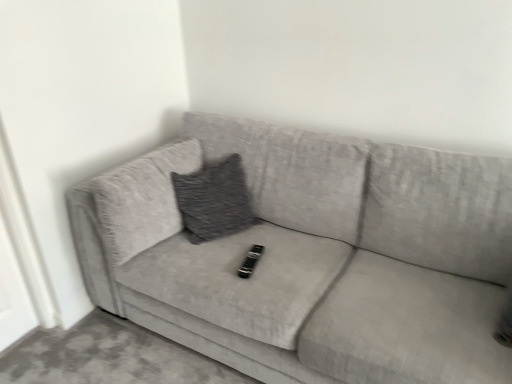
Describe the element at coordinates (250, 261) in the screenshot. I see `black plastic remote at center` at that location.

In order to face black plastic remote at center, should I rotate leftwards or rightwards?

Turn left approximately 0.611 degrees to face it.

At what (x,y) coordinates should I click in order to perform the action: click on black plastic remote at center. Please return your answer as a coordinate pair (x, y). The height and width of the screenshot is (384, 512). Looking at the image, I should click on (250, 261).

What is the approximate width of textured gray couch at center?

textured gray couch at center is 1.01 meters wide.

The image size is (512, 384). What do you see at coordinates (312, 256) in the screenshot?
I see `textured gray couch at center` at bounding box center [312, 256].

Where is `textured gray couch at center`? This screenshot has height=384, width=512. textured gray couch at center is located at coordinates (312, 256).

Where is `black plastic remote at center`? The height and width of the screenshot is (384, 512). black plastic remote at center is located at coordinates (250, 261).

Is black plastic remote at center at the right side of textured gray couch at center?

No, black plastic remote at center is not to the right of textured gray couch at center.

Considering the relative positions of black plastic remote at center and textured gray couch at center in the image provided, is black plastic remote at center in front of textured gray couch at center?

No, it is behind textured gray couch at center.

Considering the points (246, 271) and (280, 327), which point is in front, point (246, 271) or point (280, 327)?

Point (280, 327)

From the image's perspective, which one is positioned higher, black plastic remote at center or textured gray couch at center?

textured gray couch at center appears higher in the image.

From a real-world perspective, which is physically below, black plastic remote at center or textured gray couch at center?

In real-world perspective, textured gray couch at center is lower.

Does black plastic remote at center have a lesser width compared to textured gray couch at center?

Correct, the width of black plastic remote at center is less than that of textured gray couch at center.

Is black plastic remote at center taller than textured gray couch at center?

In fact, black plastic remote at center may be shorter than textured gray couch at center.

Considering the sizes of black plastic remote at center and textured gray couch at center in the image, is black plastic remote at center bigger or smaller than textured gray couch at center?

black plastic remote at center is smaller than textured gray couch at center.

Is textured gray couch at center surrounded by black plastic remote at center?

No, textured gray couch at center is not inside black plastic remote at center.

Is black plastic remote at center in contact with textured gray couch at center?

black plastic remote at center is not next to textured gray couch at center, and they're not touching.

Is black plastic remote at center oriented towards textured gray couch at center?

Yes, black plastic remote at center is oriented towards textured gray couch at center.

Find the location of a particular element. The width and height of the screenshot is (512, 384). studio couch on the right of black plastic remote at center is located at coordinates (312, 256).

Does textured gray couch at center appear on the left side of black plastic remote at center?

In fact, textured gray couch at center is to the right of black plastic remote at center.

Does textured gray couch at center come behind black plastic remote at center?

No, the depth of textured gray couch at center is less than that of black plastic remote at center.

Does point (443, 240) appear closer or farther from the camera than point (240, 274)?

Point (443, 240) is farther from the camera than point (240, 274).

From the image's perspective, is textured gray couch at center below black plastic remote at center?

No, from the image's perspective, textured gray couch at center is not below black plastic remote at center.

From a real-world perspective, is textured gray couch at center physically located above or below black plastic remote at center?

textured gray couch at center is below black plastic remote at center.

Which object is thinner, textured gray couch at center or black plastic remote at center?

With smaller width is black plastic remote at center.

Which of these two, textured gray couch at center or black plastic remote at center, stands taller?

textured gray couch at center is taller.

Does textured gray couch at center have a smaller size compared to black plastic remote at center?

Actually, textured gray couch at center might be larger than black plastic remote at center.

Would you say textured gray couch at center is inside or outside black plastic remote at center?

textured gray couch at center exists outside the volume of black plastic remote at center.

Is textured gray couch at center placed right next to black plastic remote at center?

There is a gap between textured gray couch at center and black plastic remote at center.

Does textured gray couch at center turn towards black plastic remote at center?

Yes, textured gray couch at center is aimed at black plastic remote at center.

The width and height of the screenshot is (512, 384). In order to click on remote behind the textured gray couch at center in this screenshot , I will do `click(250, 261)`.

Find the location of a particular element. This screenshot has width=512, height=384. remote located above the textured gray couch at center (from a real-world perspective) is located at coordinates (250, 261).

Find the location of a particular element. The image size is (512, 384). studio couch in front of the black plastic remote at center is located at coordinates (312, 256).